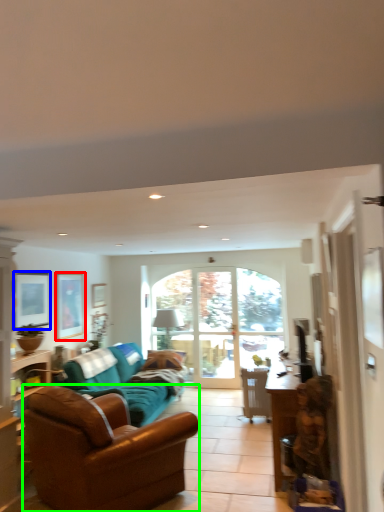
Question: Considering the real-world distances, which object is farthest from picture frame (highlighted by a red box)? picture frame (highlighted by a blue box) or studio couch (highlighted by a green box)?

Choices:
 (A) picture frame
 (B) studio couch

Answer: (B)